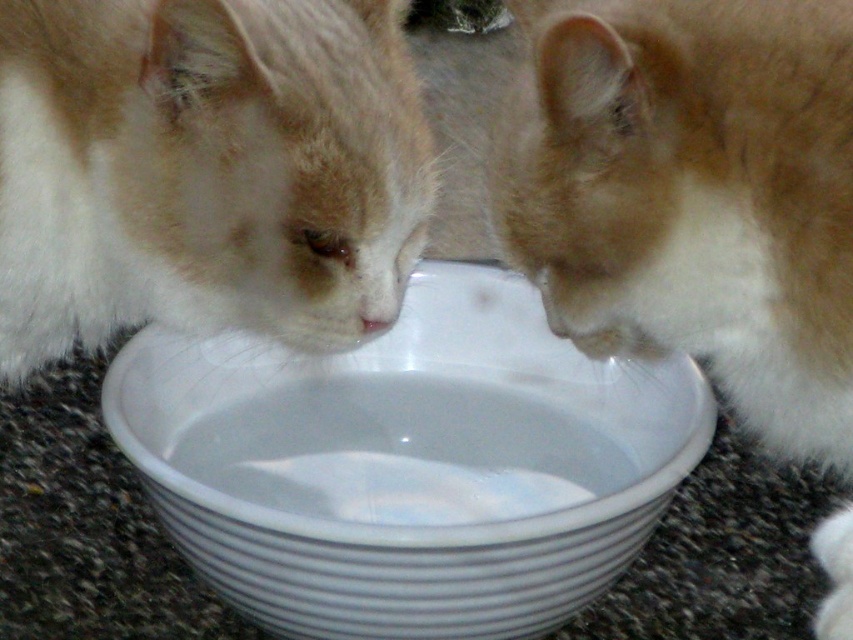
Question: Is fluffy white cat at left positioned at the back of fluffy orange-white cat at center?

Choices:
 (A) yes
 (B) no

Answer: (A)

Question: Which point is farther to the camera?

Choices:
 (A) (677, 157)
 (B) (282, 8)
 (C) (248, 474)

Answer: (C)

Question: Which point is closer to the camera taking this photo?

Choices:
 (A) (410, 172)
 (B) (682, 320)
 (C) (173, 464)

Answer: (B)

Question: Which point appears farthest from the camera in this image?

Choices:
 (A) (724, 232)
 (B) (293, 524)

Answer: (A)

Question: Is fluffy white cat at left positioned at the back of fluffy orange-white cat at center?

Choices:
 (A) no
 (B) yes

Answer: (B)

Question: Is white glossy bowl at center thinner than fluffy white cat at left?

Choices:
 (A) yes
 (B) no

Answer: (B)